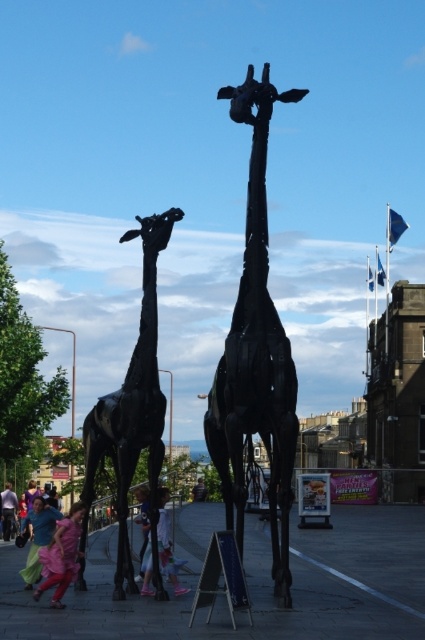
You are standing in the plaza and want to take a photo of the black metal giraffe at center without the matte blue dress at lower left appearing in the frame. Is this possible given their positions?

The black metal giraffe at center is positioned over the matte blue dress at lower left, so it would be difficult to capture the giraffe without the dress appearing in the photo unless you adjust your angle or move further back to exclude the dress from the frame.

You are standing in the plaza and want to take a photo of the two large dark giraffe sculptures. There is a point at coordinates point (95,468) that is 76.70 meters away from you. If you move forward 10 meters towards that point, will you be closer to the giraffe sculptures?

Yes, moving forward 10 meters towards the point (95,468) will bring you closer to the giraffe sculptures since the point is 76.70 meters away from your current position, reducing the distance to 66.70 meters.

You are a visitor in the plaza and want to take a photo of both the black matte giraffe at left and the pink fabric pants at lower center. Which object should you focus on first to ensure both are in frame?

You should focus on the black matte giraffe at left first because it is taller than the pink fabric pants at lower center, so adjusting the camera angle to include its height will naturally include the shorter pink fabric pants at lower center in the frame.